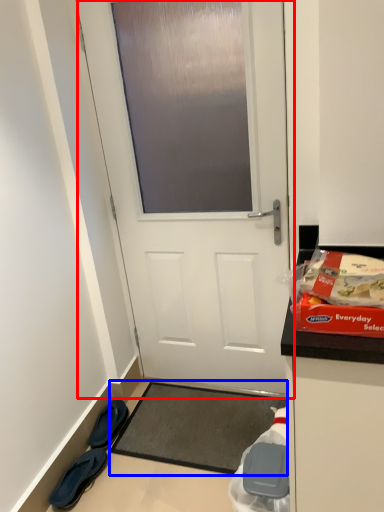
Question: Which point is closer to the camera, door (highlighted by a red box) or yoga mat (highlighted by a blue box)?

Choices:
 (A) door
 (B) yoga mat

Answer: (A)